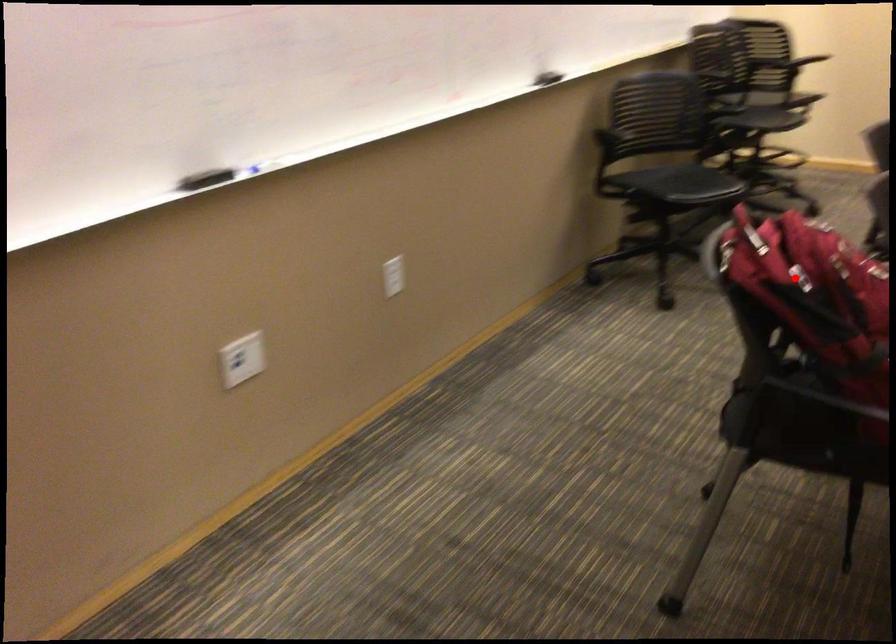
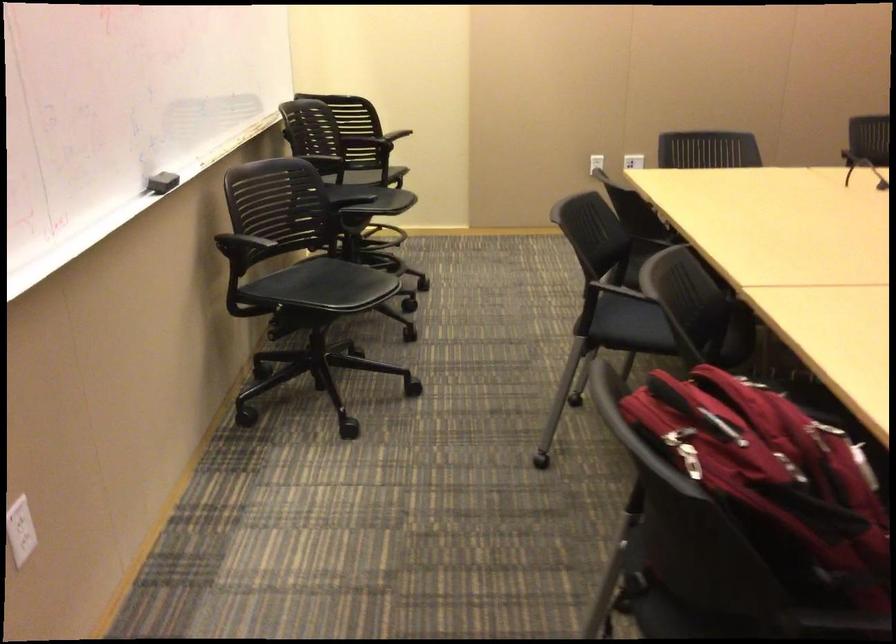
Question: I am providing you with two images of the same scene from different viewpoints. In image1, a red point is highlighted. Considering the same 3D point in image2, which of the following is correct?

Choices:
 (A) It is closer
 (B) It is farther

Answer: (A)